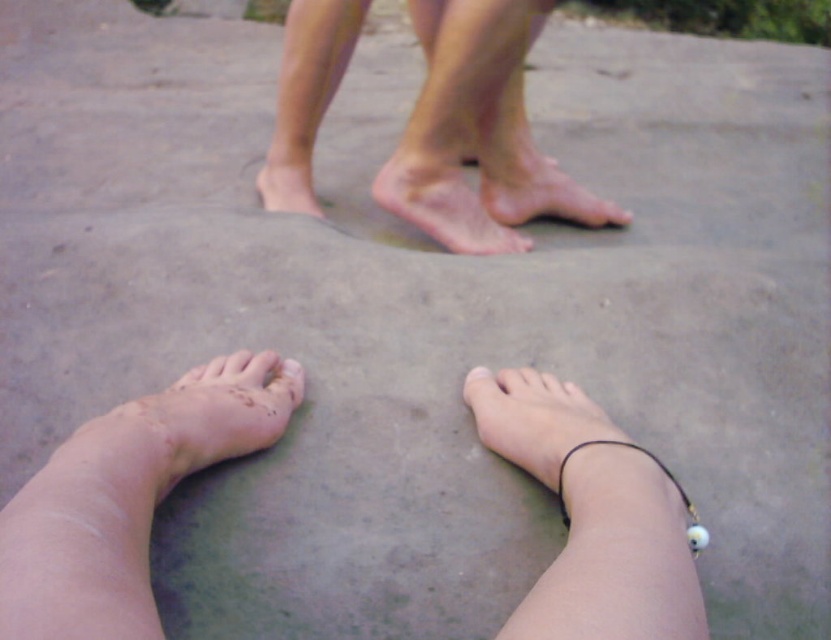
You are examining the feet in the image and notice a specific area. Where exactly is the dry skin at lower left positioned in relation to the coordinate system of the image?

The dry skin at lower left is located at point (219, 413) in the image coordinate system.

What is the texture of the skin at the point marked by the coordinates (613, 214) in the image?

The point at coordinates (613, 214) indicates smooth skin toe at center.

You are standing in an outdoor area with two pairs of feet visible. You need to determine which toe is closer to you between the smooth skin toe at center and the white matte toe at center. Based on their positions, which one is nearer?

The smooth skin toe at center is closer to the viewer than the white matte toe at center.